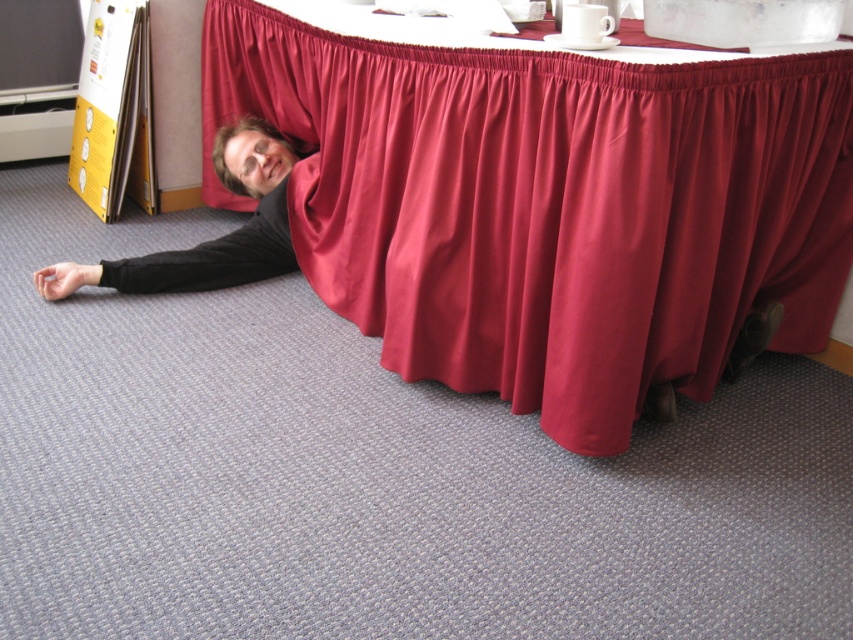
You are planning to hang a new curtain in your living room and need to know which item in the scene has a greater width. Which object between the burgundy satin curtain at lower center and the black matte shirt at lower left is wider?

The burgundy satin curtain at lower center is wider than the black matte shirt at lower left according to the description.

You are standing in a room and see a point at coordinates (x=548, y=205). Based on the scene description, what object is this point located on?

The point at coordinates (x=548, y=205) is located on the burgundy satin curtain at lower center.

In the scene shown: You are a delivery person who needs to place a package between the burgundy satin curtain at lower center and the black matte shirt at lower left. Can you fit the package there if it measures 24 inches in length?

The distance between the burgundy satin curtain at lower center and the black matte shirt at lower left is 24.44 inches. Since the package is 24 inches long, it should fit comfortably with a small amount of space to spare.